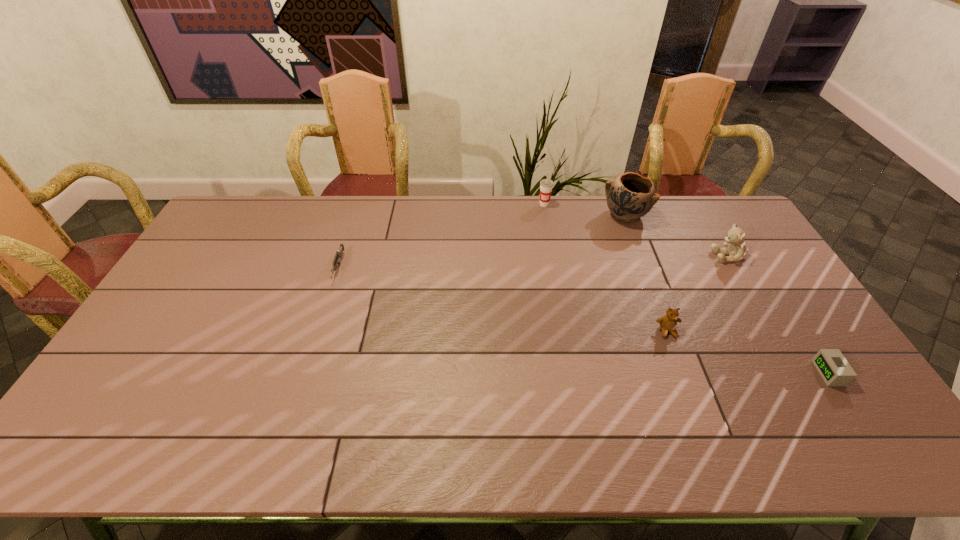
The width and height of the screenshot is (960, 540). What are the coordinates of `vacant space situated 0.210m on the face of the taller teddy bear` in the screenshot? It's located at (649, 256).

In order to click on vacant space located on the face of the taller teddy bear in this screenshot , I will do `click(622, 256)`.

This screenshot has width=960, height=540. I want to click on vacant area located on the face of the taller teddy bear, so click(646, 256).

Where is `free location located on the front-facing side of the fifth farthest object`? The image size is (960, 540). free location located on the front-facing side of the fifth farthest object is located at coordinates (693, 400).

Find the location of `vacant region located on the front-facing side of the alarm clock`. vacant region located on the front-facing side of the alarm clock is located at coordinates (666, 373).

The width and height of the screenshot is (960, 540). Find the location of `vacant region located on the front-facing side of the alarm clock`. vacant region located on the front-facing side of the alarm clock is located at coordinates (x=728, y=373).

Locate an element on the screen. This screenshot has height=540, width=960. vacant space located 0.330m on the front-facing side of the alarm clock is located at coordinates (693, 373).

Find the location of `vacant space situated aimed along the barrel of the gun`. vacant space situated aimed along the barrel of the gun is located at coordinates point(309,360).

Image resolution: width=960 pixels, height=540 pixels. What are the coordinates of `pottery situated at the far edge` in the screenshot? It's located at (631, 196).

I want to click on cup that is at the far edge, so click(546, 185).